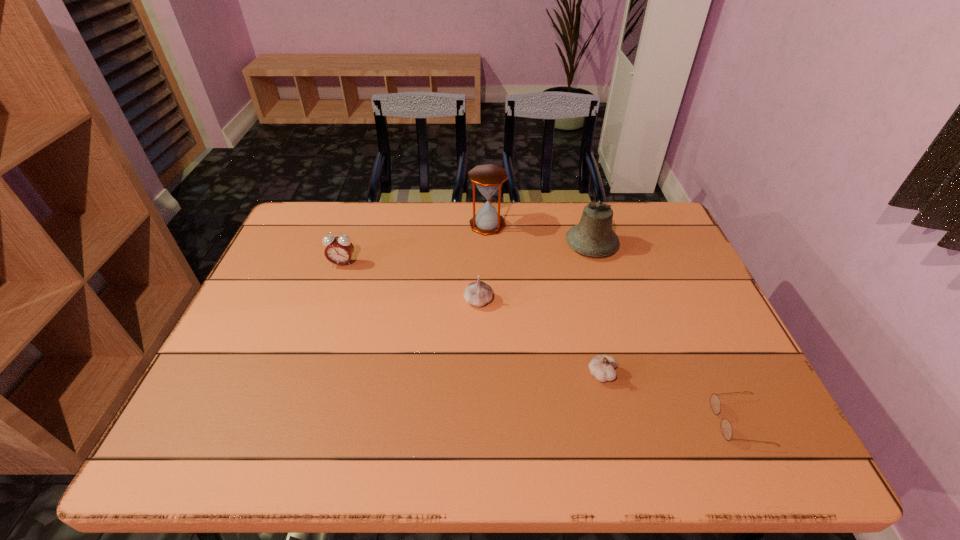
I want to click on free space located on the left of the tallest object, so click(391, 225).

Locate an element on the screen. The width and height of the screenshot is (960, 540). free region located on the right of the second tallest object is located at coordinates (682, 245).

The height and width of the screenshot is (540, 960). I want to click on vacant space located on the clock face of the alarm clock, so click(x=331, y=297).

The image size is (960, 540). I want to click on blank space located on the left of the third nearest object, so click(397, 301).

The image size is (960, 540). Identify the location of free space located 0.070m on the left of the second nearest object. (558, 374).

The width and height of the screenshot is (960, 540). Identify the location of vacant space located 0.230m on the temples of the shortest object. (607, 422).

Where is `vacant area situated 0.380m on the temples of the shortest object`? vacant area situated 0.380m on the temples of the shortest object is located at coordinates (537, 422).

Locate an element on the screen. vacant space located on the temples of the shortest object is located at coordinates (541, 422).

The image size is (960, 540). I want to click on hourglass that is at the far edge, so click(x=488, y=178).

Locate an element on the screen. The width and height of the screenshot is (960, 540). bell located in the far edge section of the desktop is located at coordinates (593, 236).